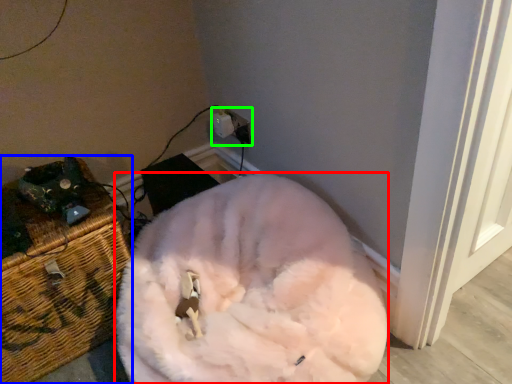
Question: Based on their relative distances, which object is nearer to animal (highlighted by a red box)? Choose from furniture (highlighted by a blue box) and electric outlet (highlighted by a green box).

Choices:
 (A) furniture
 (B) electric outlet

Answer: (A)